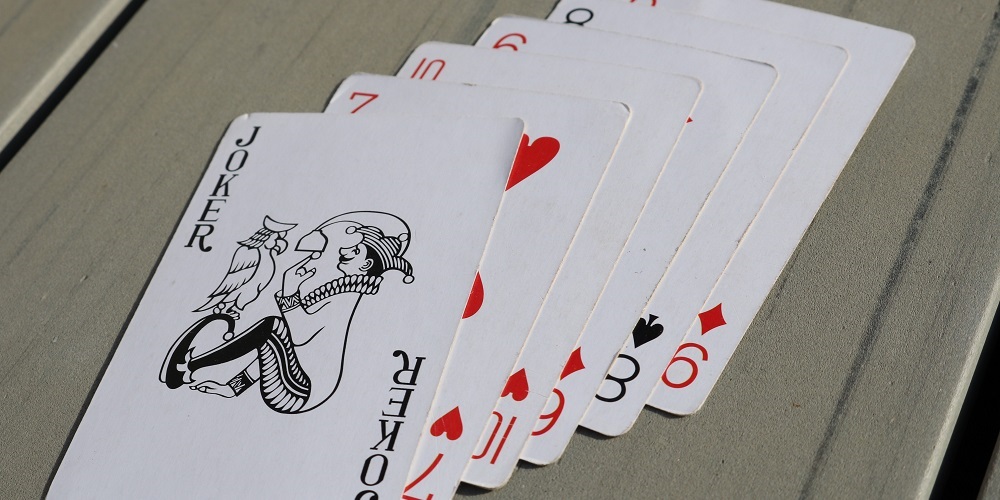
Where is `playing cards`? This screenshot has height=500, width=1000. playing cards is located at coordinates (273, 363), (483, 332), (571, 313), (623, 304), (661, 310), (716, 292).